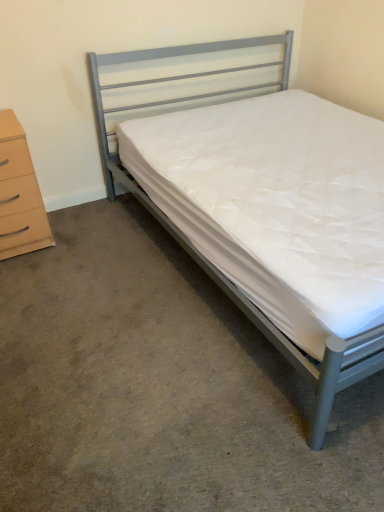
This screenshot has width=384, height=512. Identify the location of vacant region in front of beige wood chest of drawers at left. (31, 273).